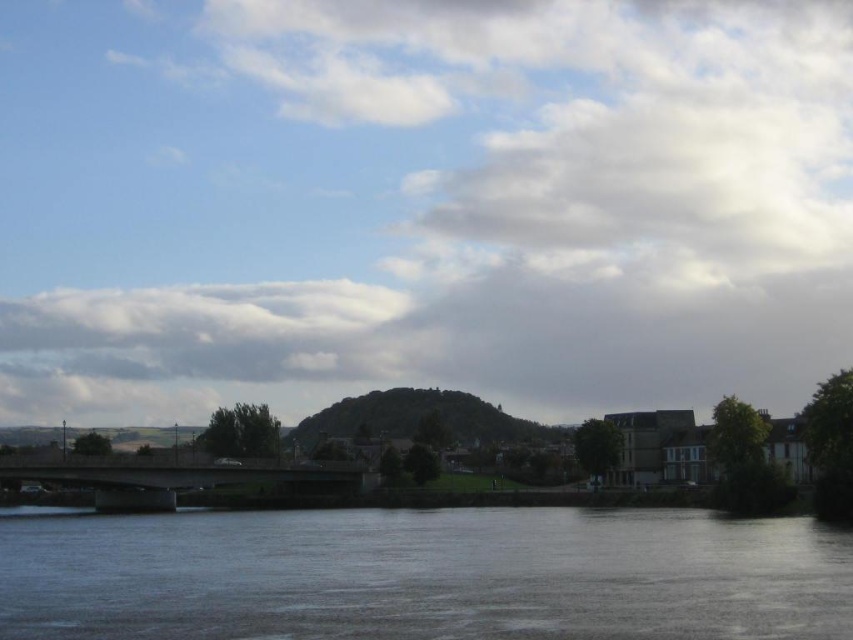
Can you confirm if cloudy sky at center is positioned to the left of smooth gray water at lower center?

Indeed, cloudy sky at center is positioned on the left side of smooth gray water at lower center.

Which is behind, point (585, 304) or point (416, 540)?

The point (585, 304) is more distant.

The image size is (853, 640). What do you see at coordinates (421, 204) in the screenshot? I see `cloudy sky at center` at bounding box center [421, 204].

At what (x,y) coordinates should I click in order to perform the action: click on cloudy sky at center. Please return your answer as a coordinate pair (x, y). Looking at the image, I should click on (421, 204).